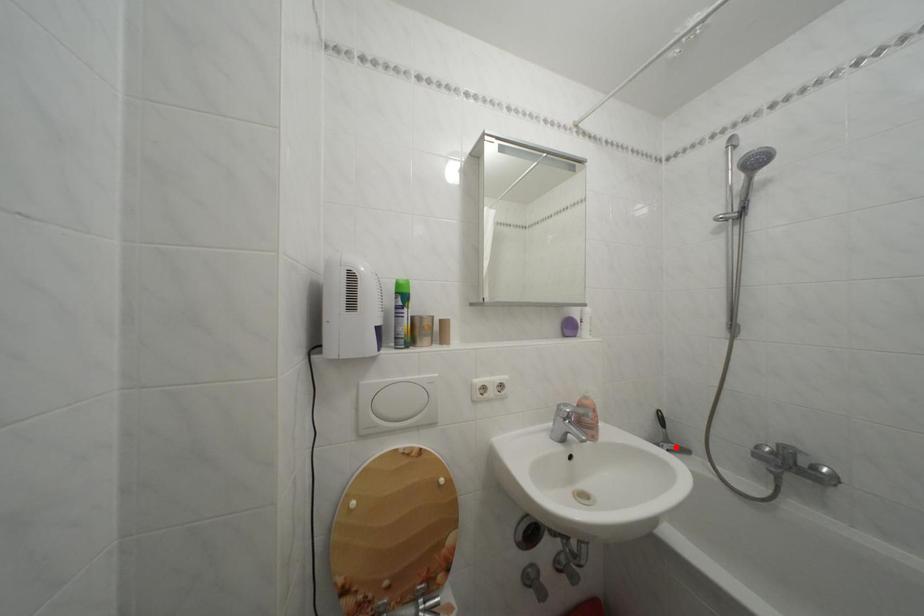
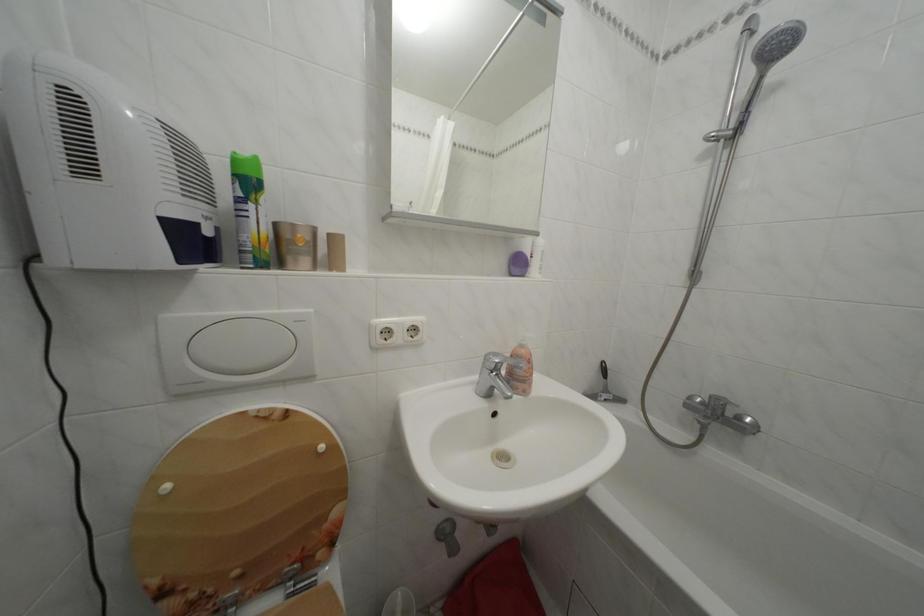
Find the pixel in the second image that matches the highlighted location in the first image.

(614, 397)